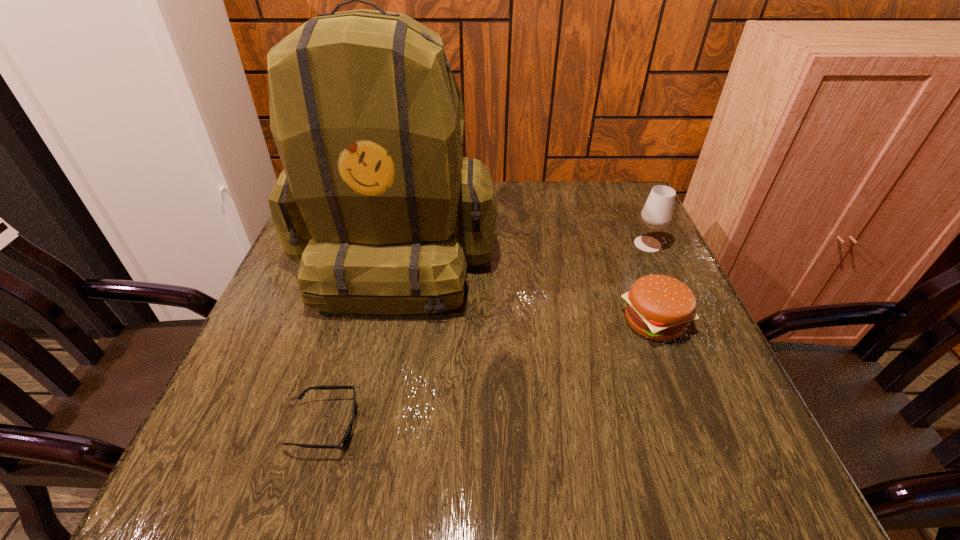
The width and height of the screenshot is (960, 540). I want to click on object identified as the closest to the nearest object, so click(376, 202).

Identify which object is the second nearest to the sunglasses. Please provide its 2D coordinates. Your answer should be formatted as a tuple, i.e. [(x, y)], where the tuple contains the x and y coordinates of a point satisfying the conditions above.

[(659, 307)]

I want to click on free spot that satisfies the following two spatial constraints: 1. on the front-facing side of the second shortest object; 2. on the right side of the backpack, so click(x=381, y=321).

Find the location of `free location that satisfies the following two spatial constraints: 1. on the front-facing side of the backpack; 2. on the front-facing side of the shortest object`. free location that satisfies the following two spatial constraints: 1. on the front-facing side of the backpack; 2. on the front-facing side of the shortest object is located at coordinates click(x=358, y=426).

Locate an element on the screen. This screenshot has width=960, height=540. vacant region that satisfies the following two spatial constraints: 1. on the front-facing side of the third tallest object; 2. on the left side of the tallest object is located at coordinates (381, 321).

This screenshot has height=540, width=960. I want to click on blank space that satisfies the following two spatial constraints: 1. on the front side of the glass; 2. on the front-facing side of the shortest object, so [x=731, y=426].

Where is `vacant space that satisfies the following two spatial constraints: 1. on the front-facing side of the tallest object; 2. on the front-facing side of the shortest object`? This screenshot has height=540, width=960. vacant space that satisfies the following two spatial constraints: 1. on the front-facing side of the tallest object; 2. on the front-facing side of the shortest object is located at coordinates (358, 426).

Image resolution: width=960 pixels, height=540 pixels. I want to click on vacant region that satisfies the following two spatial constraints: 1. on the front-facing side of the backpack; 2. on the right side of the hamburger, so click(381, 321).